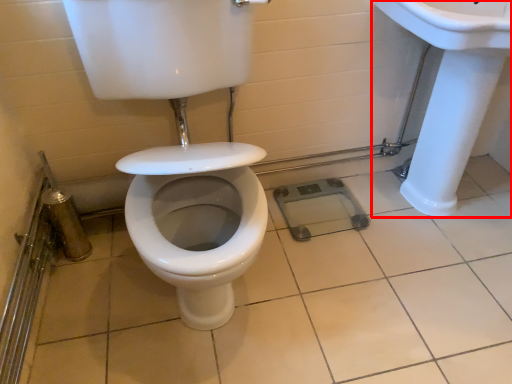
Question: Observing the image, what is the correct spatial positioning of sink (annotated by the red box) in reference to ceramic tile?

Choices:
 (A) right
 (B) left

Answer: (A)